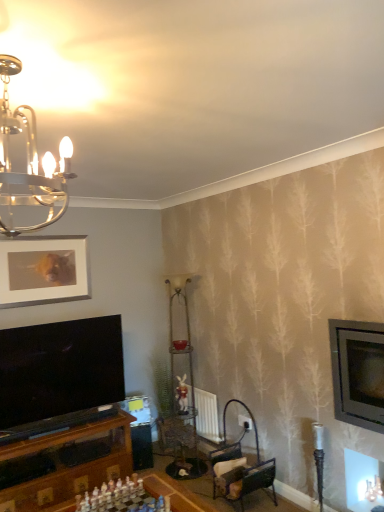
At what (x,y) coordinates should I click in order to perform the action: click on vacant region above metallic chandelier at upper left (from a real-world perspective). Please return your answer as a coordinate pair (x, y). The width and height of the screenshot is (384, 512). Looking at the image, I should click on 33,70.